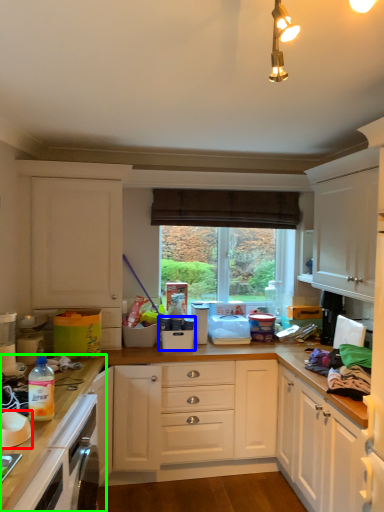
Question: Which is nearer to the bowl (highlighted by a red box)? appliance (highlighted by a blue box) or countertop (highlighted by a green box).

Choices:
 (A) appliance
 (B) countertop

Answer: (B)